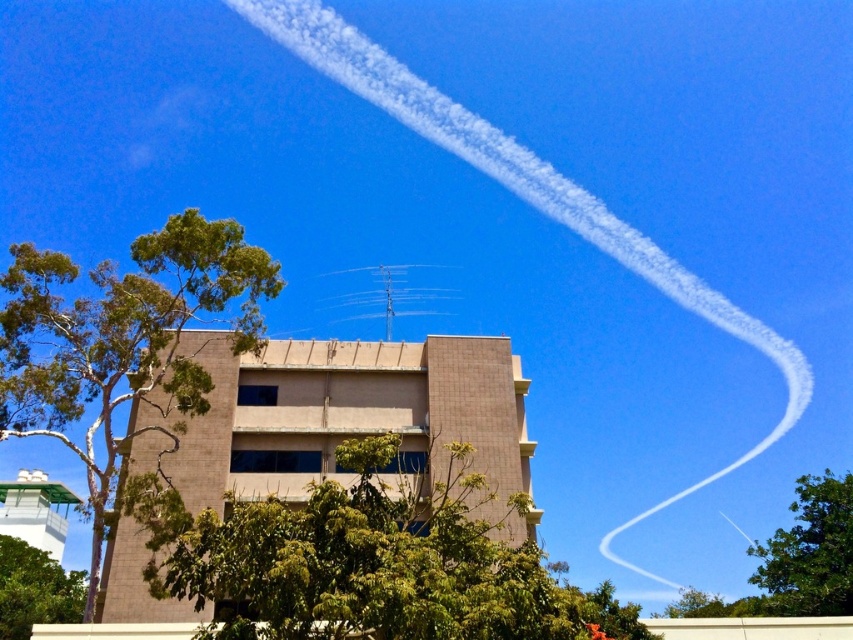
You are standing in front of the building and notice two points in the sky. The first point is at coordinates point (x=45, y=404) and the second is at point (x=51, y=595). Which point is closer to you?

Point (x=45, y=404) is closer to the camera than point (x=51, y=595).

You are standing in front of the building and looking at the two green leafy trees. Which tree is positioned higher in the sky between the green leafy tree at center and the green leafy tree at left?

The green leafy tree at center is positioned higher in the sky than the green leafy tree at left because it is above it.

You are standing in front of a building and see the green leafy tree at left and the green leafy tree at right. Which tree appears closer to you based on their positions?

The green leafy tree at left appears closer because it is positioned above the green leafy tree at right, indicating it is in a more forward layer in the scene.